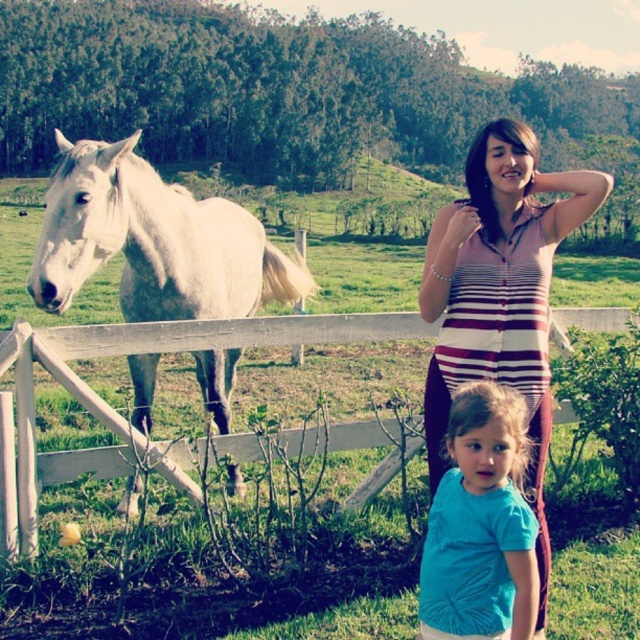
Is striped knit sweater at center smaller than white wooden fence at lower center?

Incorrect, striped knit sweater at center is not smaller in size than white wooden fence at lower center.

Can you confirm if striped knit sweater at center is thinner than white wooden fence at lower center?

Indeed, striped knit sweater at center has a lesser width compared to white wooden fence at lower center.

Describe the element at coordinates (500, 292) in the screenshot. This screenshot has width=640, height=640. I see `striped knit sweater at center` at that location.

Identify the location of striped knit sweater at center. (500, 292).

Is white matte horse at left to the right of striped knit sweater at center from the viewer's perspective?

In fact, white matte horse at left is to the left of striped knit sweater at center.

Is white matte horse at left in front of striped knit sweater at center?

No, white matte horse at left is further to the viewer.

Where is `white matte horse at left`? The width and height of the screenshot is (640, 640). white matte horse at left is located at coordinates (154, 241).

This screenshot has width=640, height=640. What are the coordinates of `white matte horse at left` in the screenshot? It's located at (154, 241).

Who is positioned more to the right, white wooden fence at lower center or teal matte shirt at lower right?

teal matte shirt at lower right is more to the right.

Does white wooden fence at lower center appear over teal matte shirt at lower right?

Yes, white wooden fence at lower center is above teal matte shirt at lower right.

What do you see at coordinates (120, 416) in the screenshot? I see `white wooden fence at lower center` at bounding box center [120, 416].

At what (x,y) coordinates should I click in order to perform the action: click on white wooden fence at lower center. Please return your answer as a coordinate pair (x, y). Looking at the image, I should click on (120, 416).